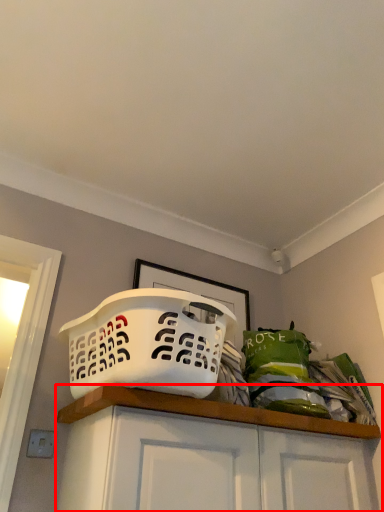
Question: From the image, what is the correct spatial relationship of cabinetry (annotated by the red box) in relation to basket?

Choices:
 (A) left
 (B) right

Answer: (B)